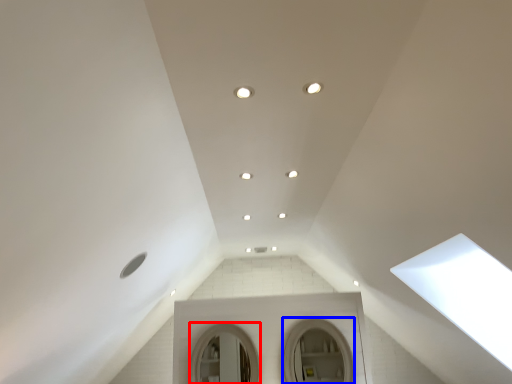
Question: Which of the following is the farthest to the observer, mirror (highlighted by a red box) or mirror (highlighted by a blue box)?

Choices:
 (A) mirror
 (B) mirror

Answer: (A)